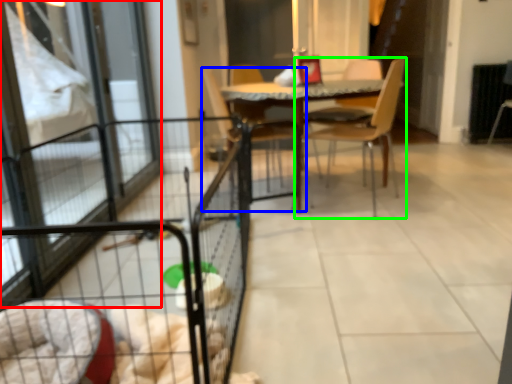
Question: Considering the real-world distances, which object is closest to screen door (highlighted by a red box)? chair (highlighted by a blue box) or chair (highlighted by a green box).

Choices:
 (A) chair
 (B) chair

Answer: (A)